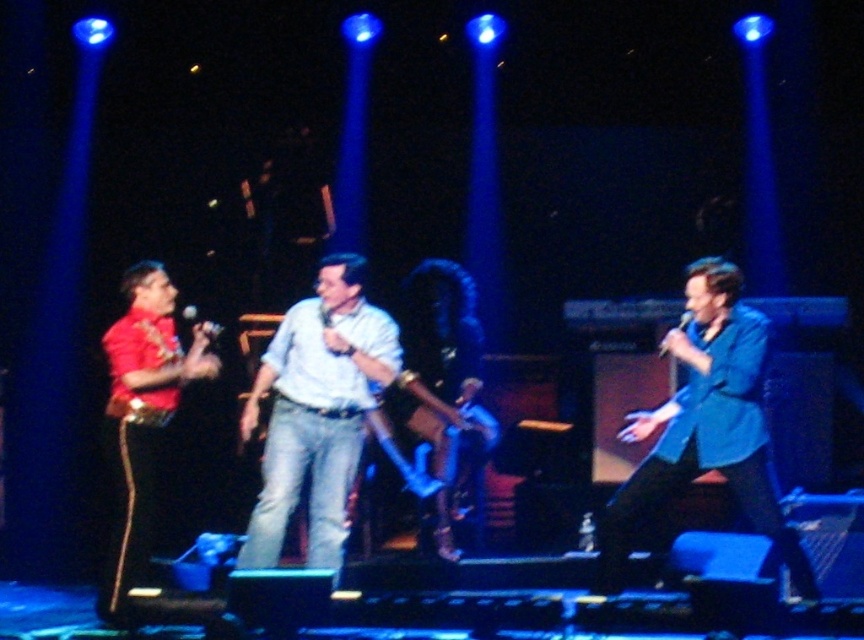
You are a photographer at the back of the stage. You want to capture a closeup of the shiny red jacket at left and the matte black microphone at center in the same frame. Which object should you zoom in on first to ensure both are in focus?

The shiny red jacket at left is wider than the matte black microphone at center, so you should zoom in on the shiny red jacket at left first to ensure both fit in the frame.

You are a stagehand adjusting the microphone stands during the performance. The two microphones are matte black microphone at center and black matte microphone at right. Which microphone requires a lower stand to accommodate its size?

The matte black microphone at center requires a lower stand because it is shorter than the black matte microphone at right.